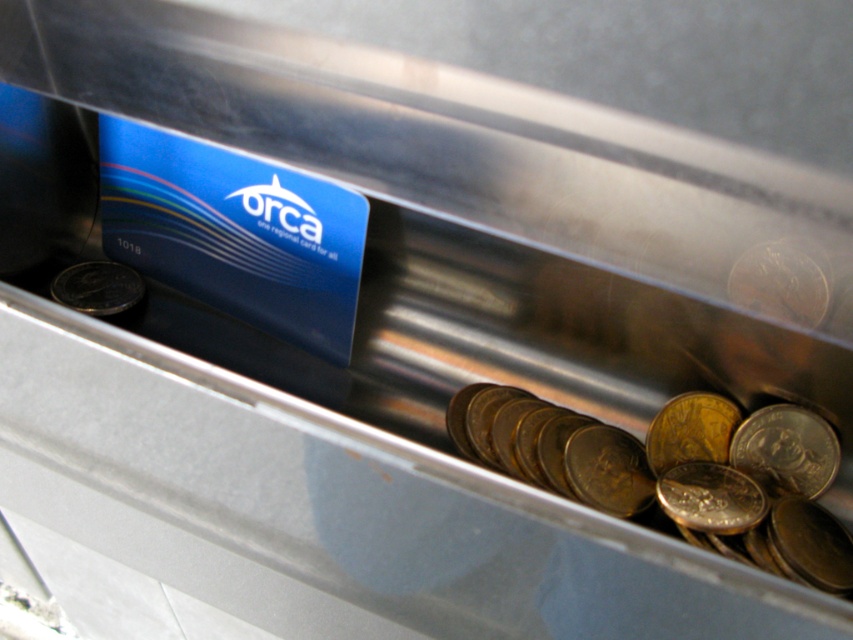
You are trying to retrieve a gold metallic coin from the slot. You see two coins inside the slot, the gold metallic coin at right and the gold metallic coin at left. Which one is closer to the opening of the slot?

The gold metallic coin at right is closer to the opening of the slot because it is in front of the gold metallic coin at left.